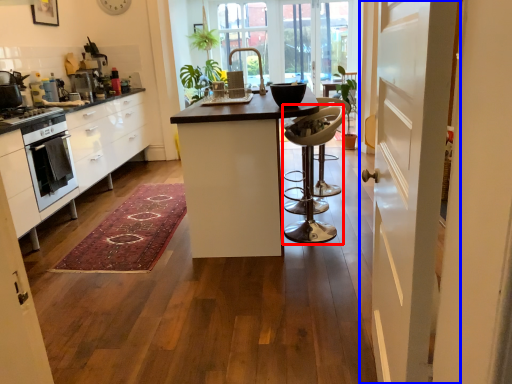
Question: Which object appears closest to the camera in this image, bar stool (highlighted by a red box) or door (highlighted by a blue box)?

Choices:
 (A) bar stool
 (B) door

Answer: (B)